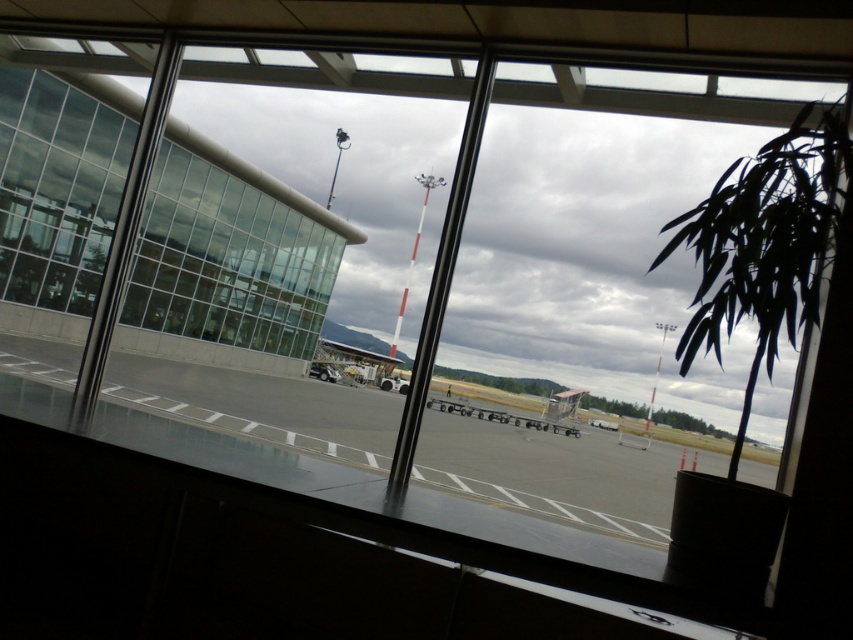
You are standing in the building and want to see the airplane parked on the tarmac outside. Is the clear glass window at left within your reach to look through?

The clear glass window at left is 11.84 feet away from the viewer, which is too far to reach, so you cannot look through it easily.

In the scene shown: You are standing inside the building looking out the window. There is a point marked at coordinates (354, 365). What object is located at that point?

The metallic gray airplane at center is located at the point (354, 365).